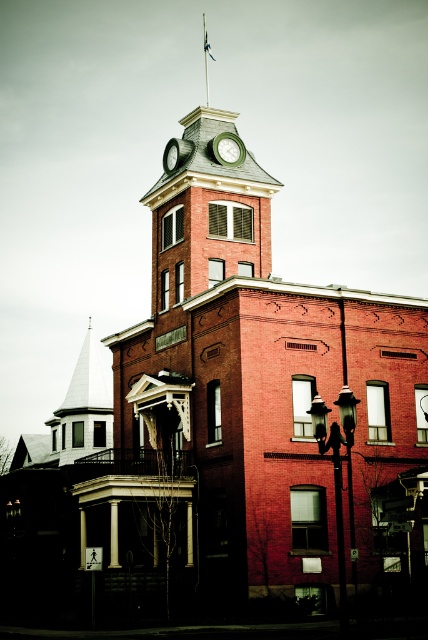
Question: Which point is closer to the camera?

Choices:
 (A) (216, 138)
 (B) (171, 164)

Answer: (A)

Question: Can you confirm if white spire at left is wider than green matte clock at upper center?

Choices:
 (A) no
 (B) yes

Answer: (B)

Question: In this image, where is white spire at left located relative to green metallic clock at center?

Choices:
 (A) left
 (B) right

Answer: (A)

Question: Which of the following is the farthest from the observer?

Choices:
 (A) green matte clock at upper center
 (B) white spire at left

Answer: (B)

Question: Which point is closer to the camera?

Choices:
 (A) (228, 134)
 (B) (101, 360)
 (C) (166, 156)

Answer: (A)

Question: Can you confirm if white spire at left is bigger than green matte clock at upper center?

Choices:
 (A) no
 (B) yes

Answer: (B)